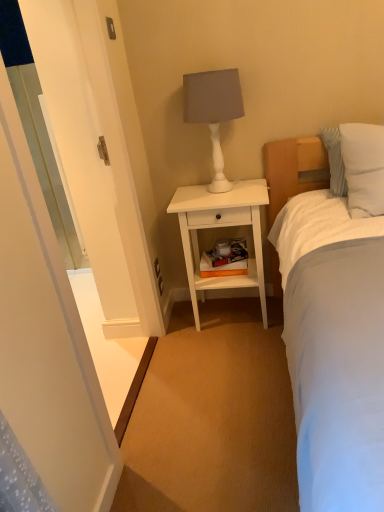
The image size is (384, 512). What are the coordinates of `vacant space underneath white matte nightstand at center (from a real-world perspective)` in the screenshot? It's located at (226, 315).